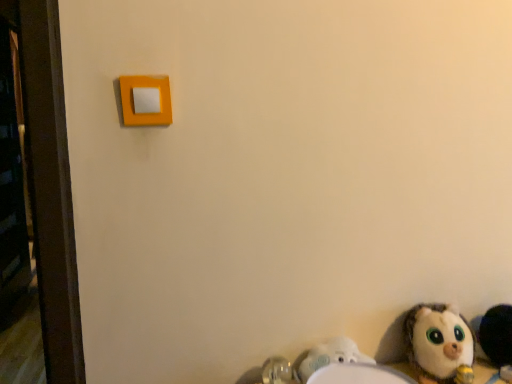
Question: Considering the relative sizes of matte orange light switch at upper left and fluffy white stuffed animal at lower right, placed as the second toy when sorted from left to right, in the image provided, is matte orange light switch at upper left bigger than fluffy white stuffed animal at lower right, placed as the second toy when sorted from left to right,?

Choices:
 (A) no
 (B) yes

Answer: (A)

Question: From a real-world perspective, does matte orange light switch at upper left stand above fluffy white stuffed animal at lower right, placed as the second toy when sorted from left to right?

Choices:
 (A) no
 (B) yes

Answer: (B)

Question: From the image's perspective, is matte orange light switch at upper left on fluffy white stuffed animal at lower right, placed as the second toy when sorted from left to right?

Choices:
 (A) no
 (B) yes

Answer: (B)

Question: Can you confirm if matte orange light switch at upper left is positioned to the right of fluffy white stuffed animal at lower right, the 1th toy viewed from the right?

Choices:
 (A) yes
 (B) no

Answer: (B)

Question: Can fluffy white stuffed animal at lower right, placed as the second toy when sorted from left to right, be found inside matte orange light switch at upper left?

Choices:
 (A) no
 (B) yes

Answer: (A)

Question: From the image's perspective, is matte orange light switch at upper left under fluffy white stuffed animal at lower right, placed as the second toy when sorted from left to right?

Choices:
 (A) yes
 (B) no

Answer: (B)

Question: From a real-world perspective, is white plush toy at lower right, arranged as the second toy when viewed from the right, located higher than matte orange light switch at upper left?

Choices:
 (A) no
 (B) yes

Answer: (A)

Question: Does white plush toy at lower right, arranged as the second toy when viewed from the right, come behind matte orange light switch at upper left?

Choices:
 (A) yes
 (B) no

Answer: (A)

Question: Is white plush toy at lower right, arranged as the second toy when viewed from the right, far from matte orange light switch at upper left?

Choices:
 (A) yes
 (B) no

Answer: (B)

Question: Considering the relative positions of white plush toy at lower right, which is counted as the 1th toy, starting from the left, and matte orange light switch at upper left in the image provided, is white plush toy at lower right, which is counted as the 1th toy, starting from the left, to the left of matte orange light switch at upper left from the viewer's perspective?

Choices:
 (A) yes
 (B) no

Answer: (B)

Question: Is white plush toy at lower right, arranged as the second toy when viewed from the right, directly adjacent to matte orange light switch at upper left?

Choices:
 (A) no
 (B) yes

Answer: (A)

Question: Does white plush toy at lower right, which is counted as the 1th toy, starting from the left, have a smaller size compared to matte orange light switch at upper left?

Choices:
 (A) yes
 (B) no

Answer: (B)

Question: Does white plastic sink at lower right have a greater width compared to fluffy white stuffed animal at lower right, the 1th toy viewed from the right?

Choices:
 (A) yes
 (B) no

Answer: (B)